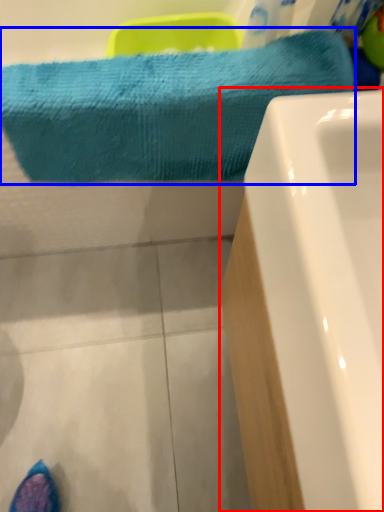
Question: Which of the following is the farthest to the observer, bathtub (highlighted by a red box) or towel (highlighted by a blue box)?

Choices:
 (A) bathtub
 (B) towel

Answer: (B)